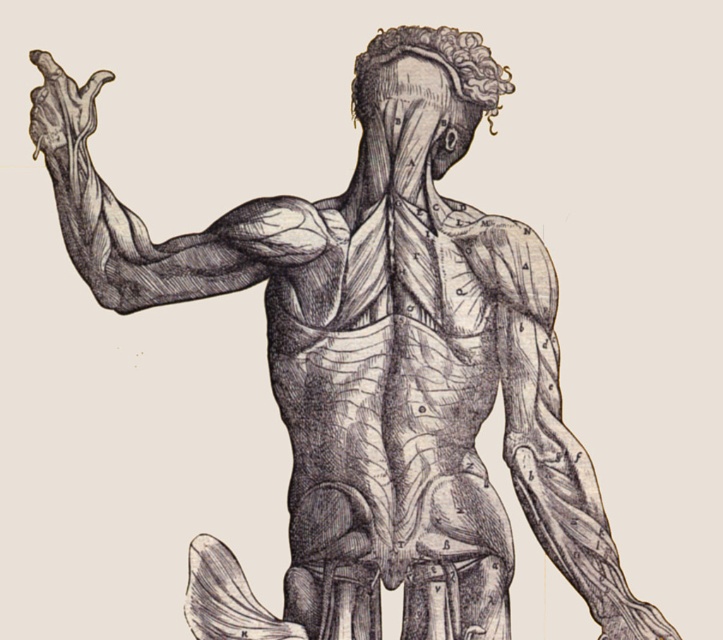
Question: Which point is closer to the camera?

Choices:
 (A) (137, 307)
 (B) (90, 93)

Answer: (B)

Question: In this image, where is smooth black arm at upper left located relative to smooth skin hand at upper left?

Choices:
 (A) below
 (B) above

Answer: (A)

Question: Does smooth black arm at upper left appear under smooth skin hand at upper left?

Choices:
 (A) no
 (B) yes

Answer: (B)

Question: Where is smooth black arm at upper left located in relation to smooth skin hand at upper left in the image?

Choices:
 (A) right
 (B) left

Answer: (A)

Question: Among these objects, which one is farthest from the camera?

Choices:
 (A) smooth black arm at upper left
 (B) smooth skin hand at upper left

Answer: (B)